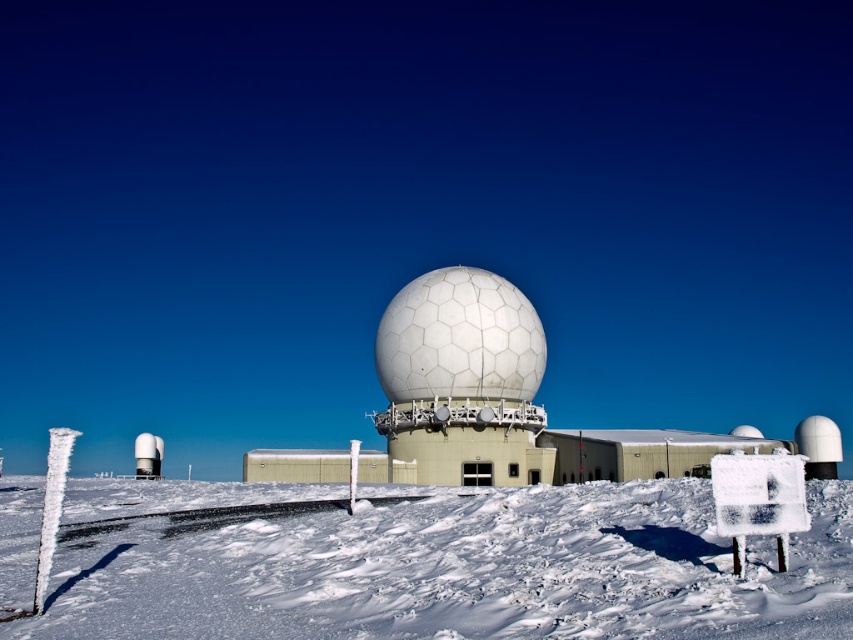
Question: Does white powdery snow at lower center appear on the right side of white hexagonal dome at center?

Choices:
 (A) no
 (B) yes

Answer: (A)

Question: Can you confirm if white powdery snow at lower center is wider than white hexagonal dome at center?

Choices:
 (A) no
 (B) yes

Answer: (B)

Question: Can you confirm if white powdery snow at lower center is positioned below white hexagonal dome at center?

Choices:
 (A) yes
 (B) no

Answer: (A)